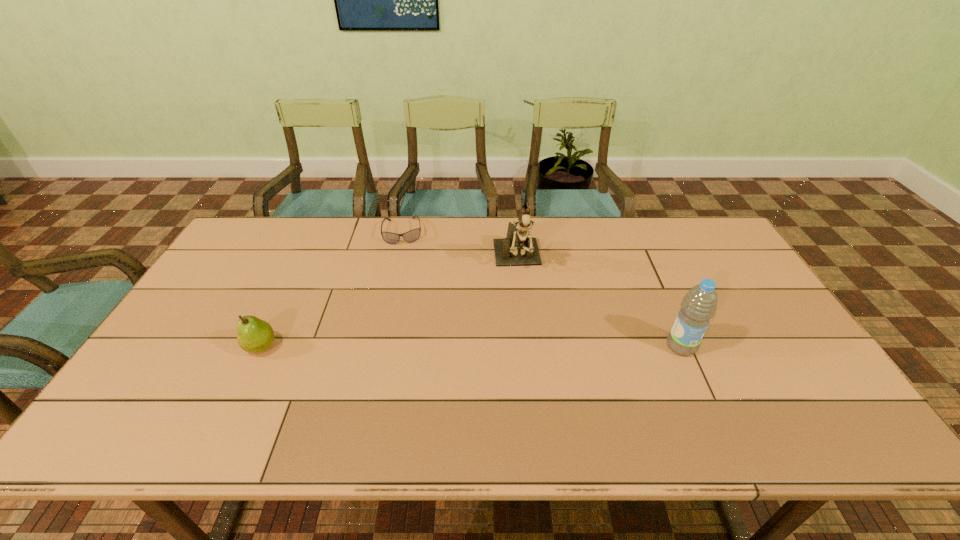
The width and height of the screenshot is (960, 540). What are the coordinates of `vacant space on the desktop that is between the second shortest object and the third shortest object and is positioned on the lenses of the shortest object` in the screenshot? It's located at (411, 347).

Locate an element on the screen. The image size is (960, 540). vacant space on the desktop that is between the leftmost object and the water bottle and is positioned on the front-facing side of the third object from left to right is located at coordinates (532, 347).